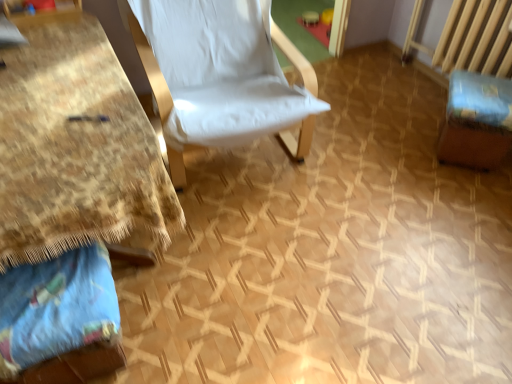
Identify the location of free point in front of brown fabric swivel chair at right. (470, 195).